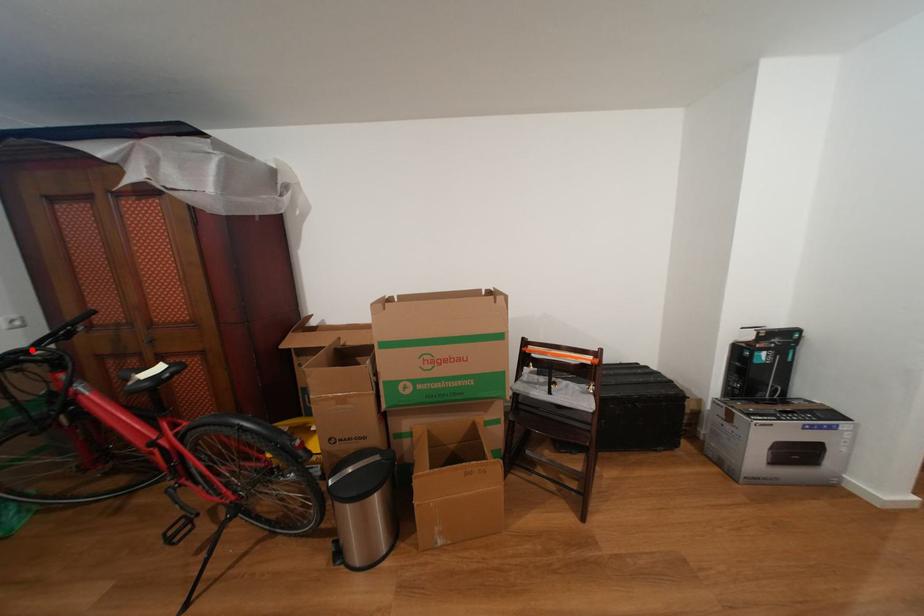
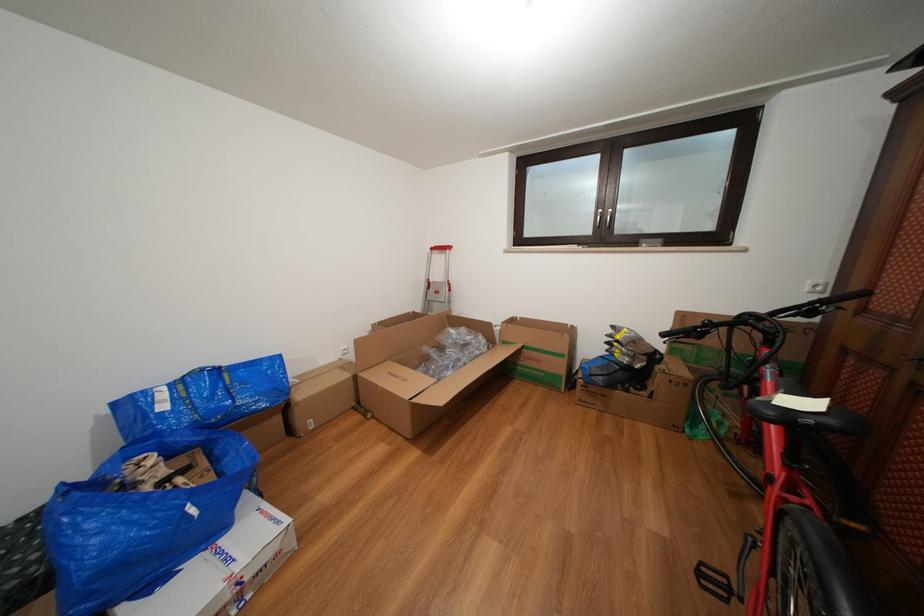
Locate, in the second image, the point that corresponds to the highlighted location in the first image.

(772, 315)